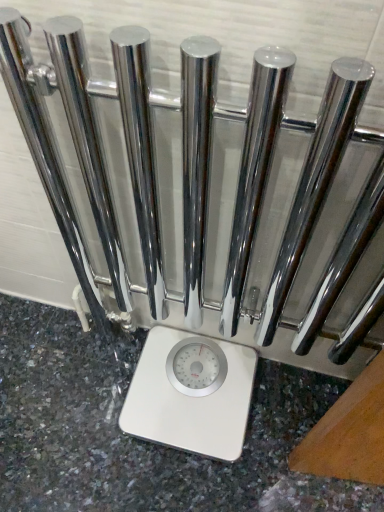
Question: Considering the relative sizes of white glossy granite at center and white glossy scale at center in the image provided, is white glossy granite at center taller than white glossy scale at center?

Choices:
 (A) no
 (B) yes

Answer: (A)

Question: Is white glossy granite at center shorter than white glossy scale at center?

Choices:
 (A) yes
 (B) no

Answer: (A)

Question: Can you confirm if white glossy granite at center is wider than white glossy scale at center?

Choices:
 (A) no
 (B) yes

Answer: (B)

Question: Is white glossy granite at center at the left side of white glossy scale at center?

Choices:
 (A) no
 (B) yes

Answer: (B)

Question: Would you consider white glossy granite at center to be distant from white glossy scale at center?

Choices:
 (A) yes
 (B) no

Answer: (B)

Question: Is white glossy granite at center at the right side of white glossy scale at center?

Choices:
 (A) yes
 (B) no

Answer: (B)

Question: Can you confirm if white glossy scale at center is positioned to the left of white glossy granite at center?

Choices:
 (A) yes
 (B) no

Answer: (B)

Question: Can you confirm if white glossy scale at center is taller than white glossy granite at center?

Choices:
 (A) yes
 (B) no

Answer: (A)

Question: Considering the relative positions of white glossy scale at center and white glossy granite at center in the image provided, is white glossy scale at center behind white glossy granite at center?

Choices:
 (A) no
 (B) yes

Answer: (B)

Question: Is the position of white glossy scale at center less distant than that of white glossy granite at center?

Choices:
 (A) no
 (B) yes

Answer: (A)

Question: Are white glossy scale at center and white glossy granite at center far apart?

Choices:
 (A) yes
 (B) no

Answer: (B)

Question: From a real-world perspective, is white glossy scale at center below white glossy granite at center?

Choices:
 (A) yes
 (B) no

Answer: (B)

Question: Considering the positions of point (240, 404) and point (135, 337), is point (240, 404) closer or farther from the camera than point (135, 337)?

Choices:
 (A) farther
 (B) closer

Answer: (B)